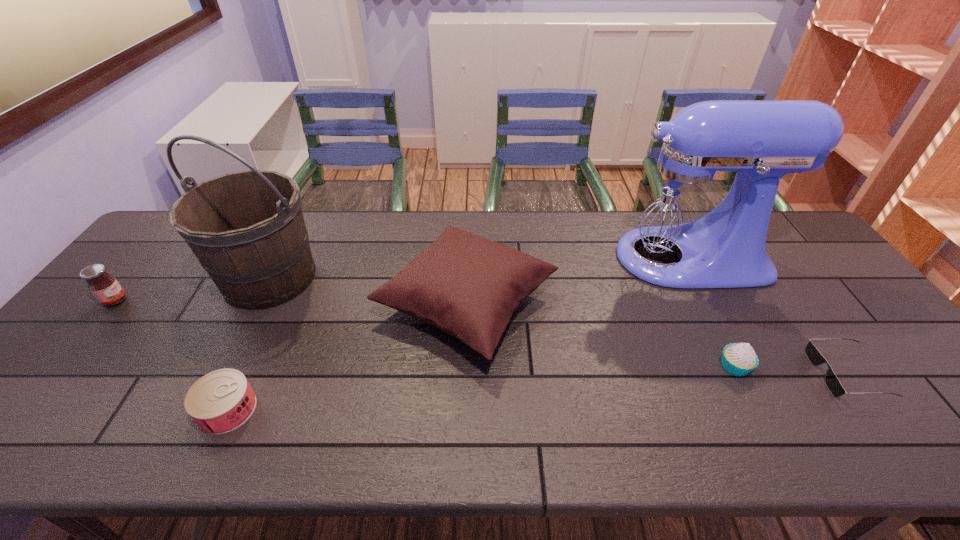
This screenshot has width=960, height=540. Identify the location of free location located at the mixing area of the mixer. (520, 258).

At what (x,y) coordinates should I click in order to perform the action: click on vacant space located 0.350m at the mixing area of the mixer. Please return your answer as a coordinate pair (x, y). Looking at the image, I should click on (492, 258).

Locate an element on the screen. The height and width of the screenshot is (540, 960). vacant space located on the right of the bucket is located at coordinates (408, 278).

Find the location of a particular element. vacant position located on the left of the fourth object from left to right is located at coordinates click(300, 303).

This screenshot has width=960, height=540. Identify the location of blank space located 0.170m on the label side of the leftmost object. (188, 301).

Where is `free spot located on the back of the third shortest object`? This screenshot has width=960, height=540. free spot located on the back of the third shortest object is located at coordinates (717, 332).

This screenshot has height=540, width=960. Identify the location of free point located 0.280m on the back of the second shortest object. (278, 299).

The height and width of the screenshot is (540, 960). Find the location of `vacant space located on the front-facing side of the sunglasses`. vacant space located on the front-facing side of the sunglasses is located at coordinates (692, 374).

Locate an element on the screen. Image resolution: width=960 pixels, height=540 pixels. free space located 0.160m on the front-facing side of the sunglasses is located at coordinates (751, 374).

The width and height of the screenshot is (960, 540). I want to click on free location located on the front-facing side of the sunglasses, so click(x=713, y=374).